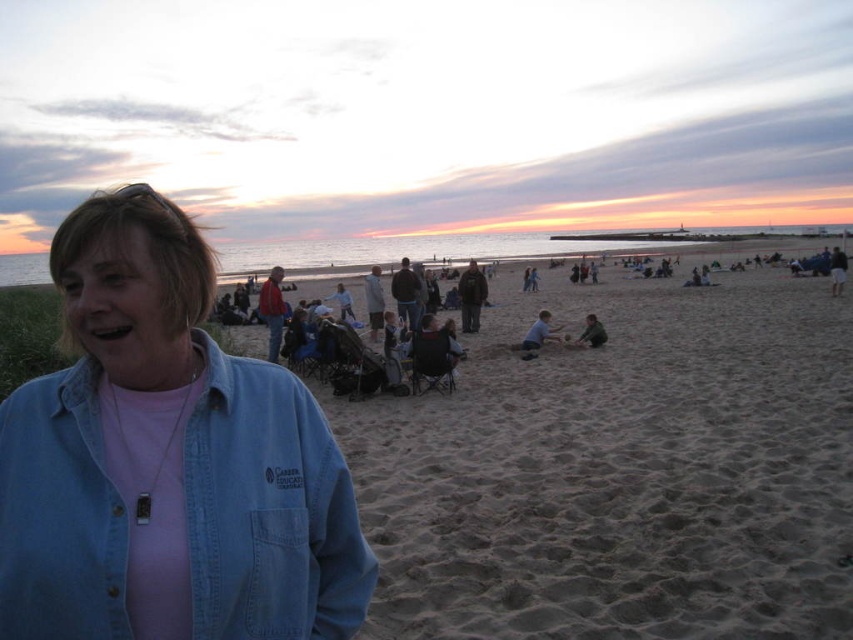
Describe the element at coordinates (619, 468) in the screenshot. I see `light brown sand at center` at that location.

Consider the image. How distant is light brown sand at center from dark gray fabric child at center?

They are 5.57 meters apart.

Describe the element at coordinates (619, 468) in the screenshot. I see `light brown sand at center` at that location.

This screenshot has height=640, width=853. I want to click on light brown sand at center, so click(x=619, y=468).

Is light brown sand at center in front of dark gray pants at right?

Yes.

This screenshot has height=640, width=853. Describe the element at coordinates (619, 468) in the screenshot. I see `light brown sand at center` at that location.

At what (x,y) coordinates should I click in order to perform the action: click on light brown sand at center. Please return your answer as a coordinate pair (x, y). Looking at the image, I should click on (619, 468).

Can you confirm if denim jacket at lower left is smaller than smooth sand at lower center?

Actually, denim jacket at lower left might be larger than smooth sand at lower center.

Can you confirm if denim jacket at lower left is wider than smooth sand at lower center?

Yes, denim jacket at lower left is wider than smooth sand at lower center.

Does point (115, 634) come behind point (550, 326)?

No, it is not.

I want to click on denim jacket at lower left, so click(167, 460).